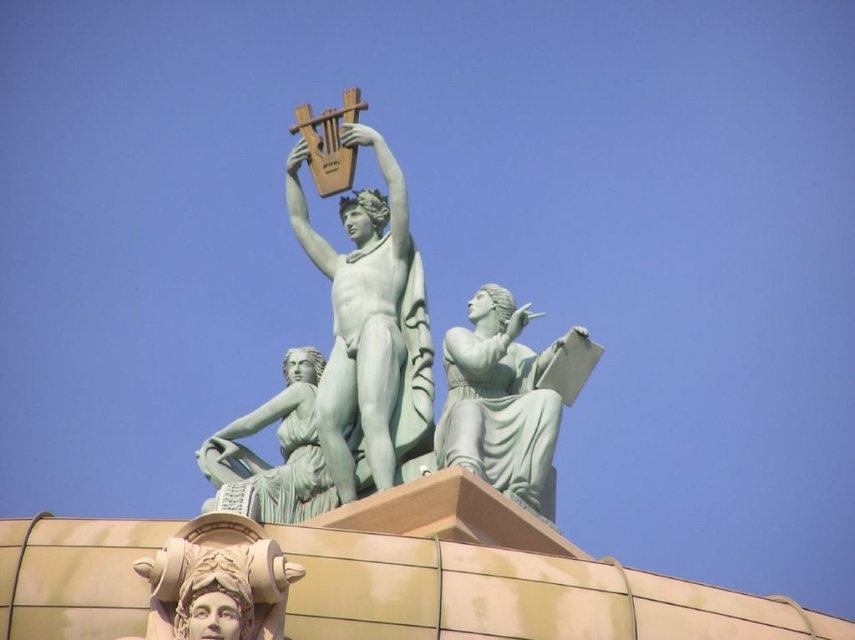
You are an architect reviewing the sculpture group. You notice two points on the sculpture at coordinates point (230, 579) and point (245, 481). Which point is closer to your viewpoint?

Point (230, 579) is closer to the camera than point (245, 481).

You are an art conservator assessing the sculptures. You need to determine which object has a greater width between the green marble lyre at center and the green marble statue at center. Which one is wider?

The green marble lyre at center is wider than the green marble statue at center according to the description.